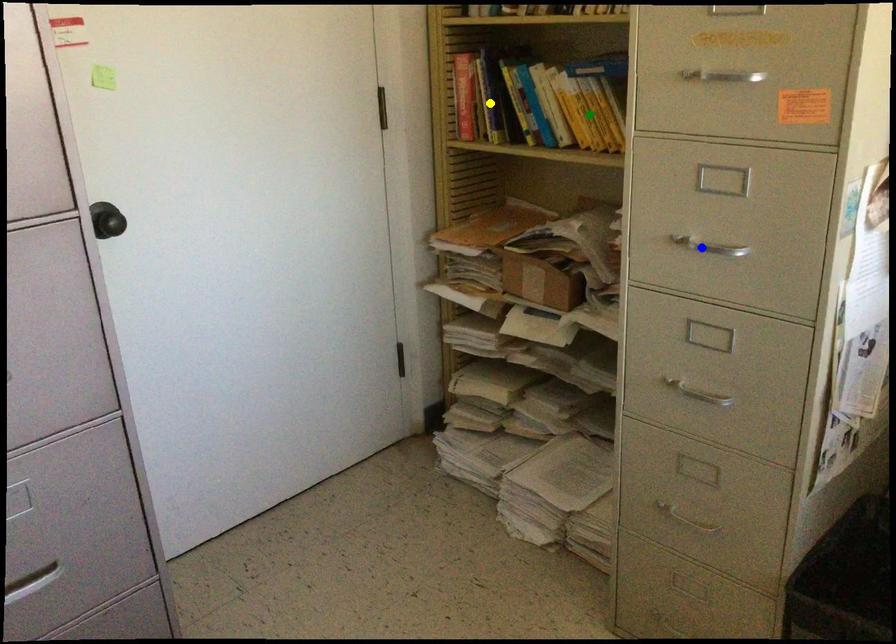
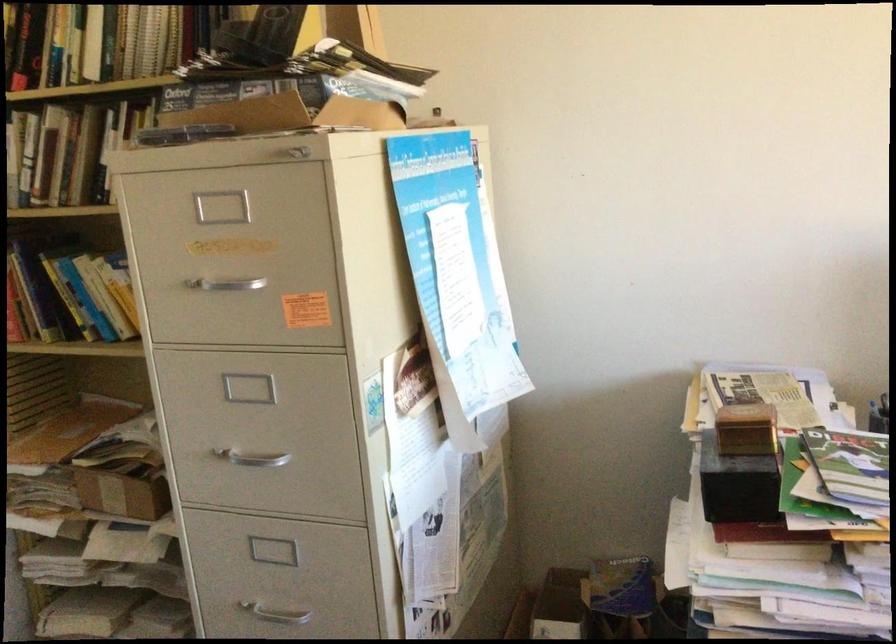
I am providing you with two images of the same scene from different viewpoints. Three points are marked in image1. Which point corresponds to a part or object that is occluded in image2?In image1, three points are marked. Which of them correspond to a part or object that is occluded in image2?Among the three points shown in image1, which one corresponds to a part or object that is no longer visible due to occlusion in image2?

Invisible in image2: green point.